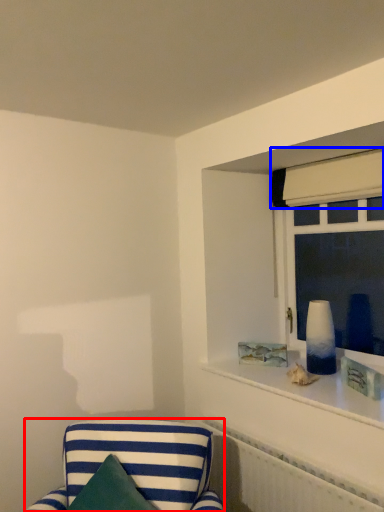
Question: Which object appears farthest to the camera in this image, furniture (highlighted by a red box) or curtain (highlighted by a blue box)?

Choices:
 (A) furniture
 (B) curtain

Answer: (B)